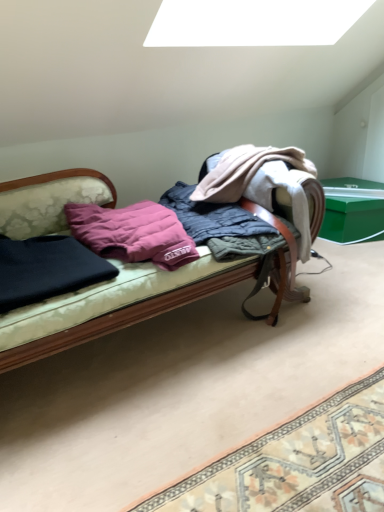
Where is `free space between velvet-like fabric couch at center and patterned fabric mat at lower right`? free space between velvet-like fabric couch at center and patterned fabric mat at lower right is located at coordinates (225, 396).